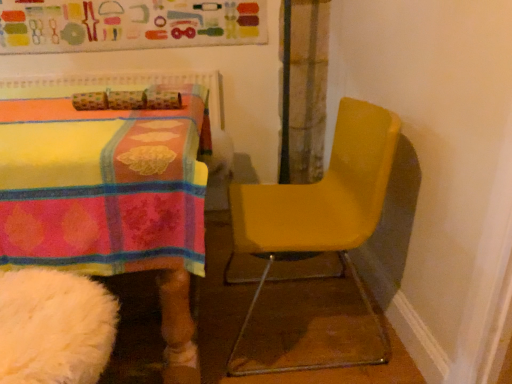
Find the location of a particular element. The height and width of the screenshot is (384, 512). free space that is to the left of yellow matte chair at right is located at coordinates pyautogui.click(x=158, y=330).